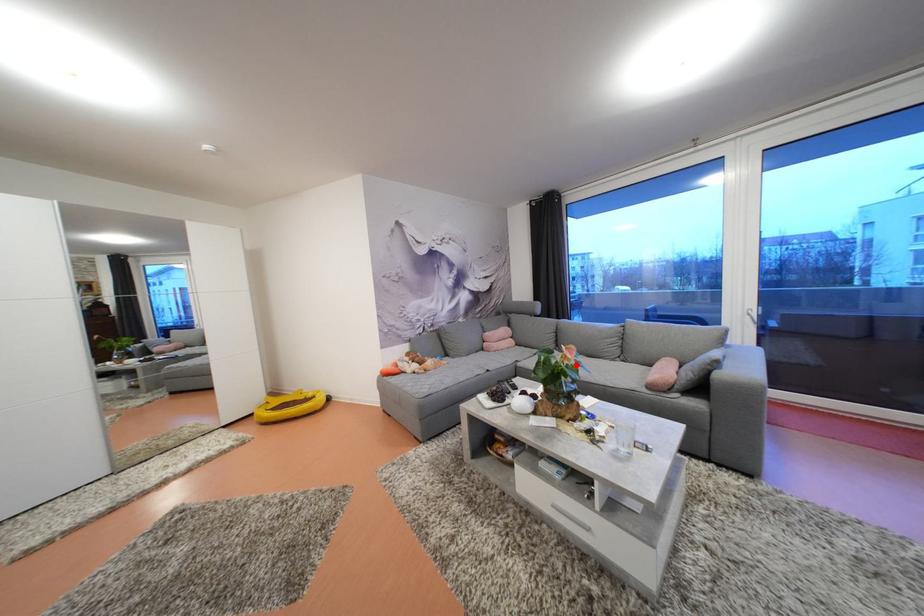
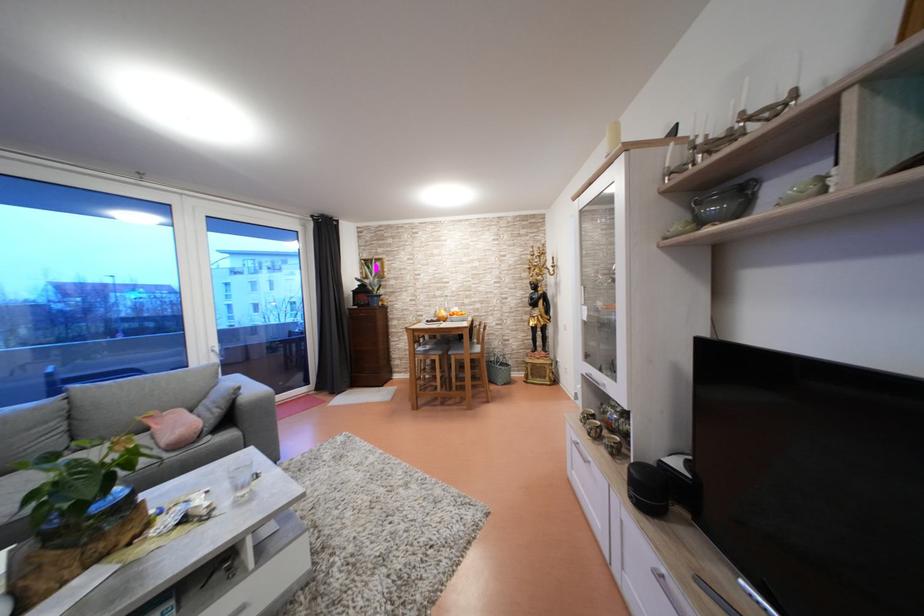
Question: I am providing you with two images of the same scene from different viewpoints. A red point is shown in image1. For the corresponding object point in image2, is it positioned nearer or farther from the camera?

Choices:
 (A) Nearer
 (B) Farther

Answer: (B)